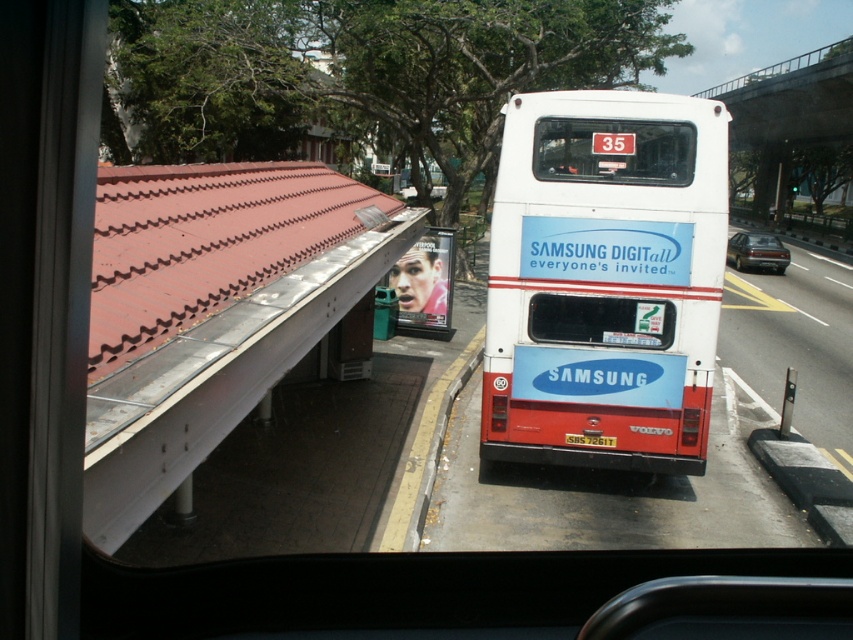
Question: Is metallic red roof at upper left wider than transparent glass windshield at center?

Choices:
 (A) yes
 (B) no

Answer: (A)

Question: Is metallic red roof at upper left thinner than transparent glass windshield at center?

Choices:
 (A) yes
 (B) no

Answer: (B)

Question: Which object appears farthest from the camera in this image?

Choices:
 (A) concrete bridge at upper right
 (B) transparent glass windshield at center
 (C) yellow plastic license plate at rear center

Answer: (A)

Question: Is yellow painted asphalt at right further to the viewer compared to concrete bridge at upper right?

Choices:
 (A) yes
 (B) no

Answer: (B)

Question: Which of the following is the closest to the observer?

Choices:
 (A) pyautogui.click(x=593, y=442)
 (B) pyautogui.click(x=811, y=116)

Answer: (A)

Question: Estimate the real-world distances between objects in this image. Which object is closer to the white glossy bus at right?

Choices:
 (A) white matte bus at center
 (B) transparent glass windshield at center
 (C) yellow painted asphalt at right
 (D) dark gray metallic sedan at right

Answer: (C)